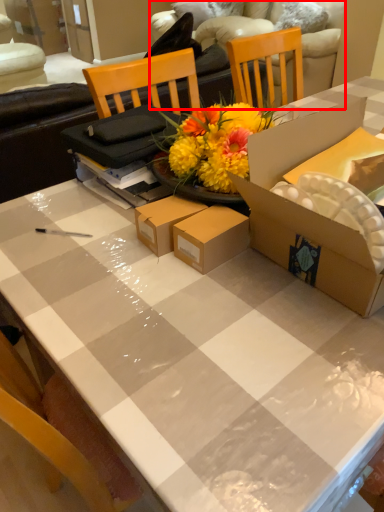
Question: From the image's perspective, where is couch (annotated by the red box) located in relation to box in the image?

Choices:
 (A) above
 (B) below

Answer: (A)